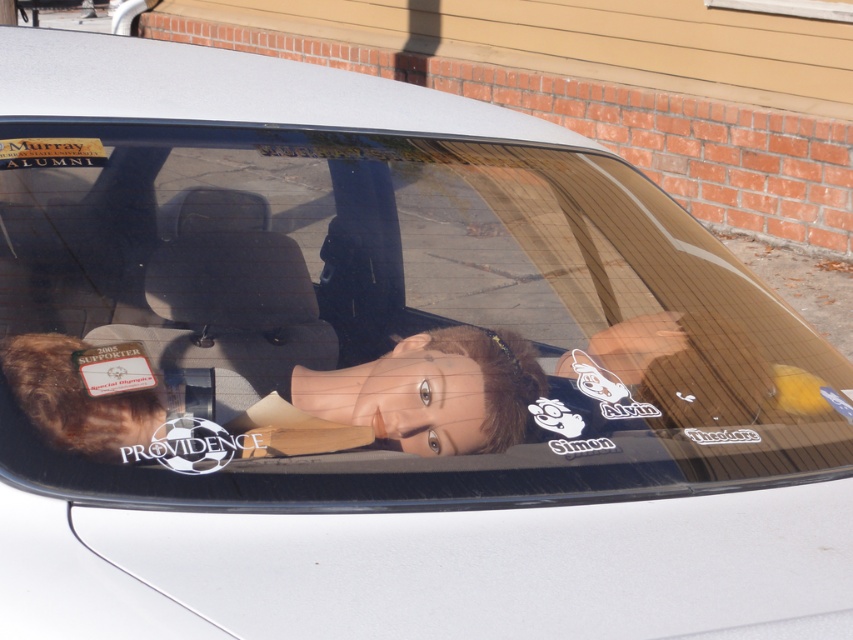
Between point (453, 426) and point (105, 388), which one is positioned behind?

Point (453, 426)

Can you confirm if brown plush toy at center is bigger than matte paper sticker at lower left?

Indeed, brown plush toy at center has a larger size compared to matte paper sticker at lower left.

Is point (367, 396) closer to camera compared to point (85, 381)?

No.

Find the location of a particular element. Image resolution: width=853 pixels, height=640 pixels. brown plush toy at center is located at coordinates (432, 392).